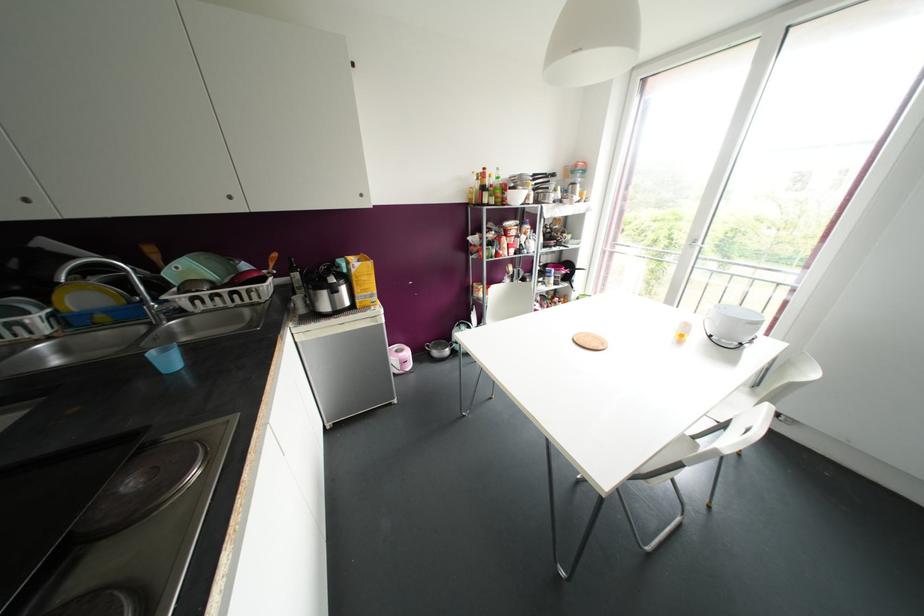
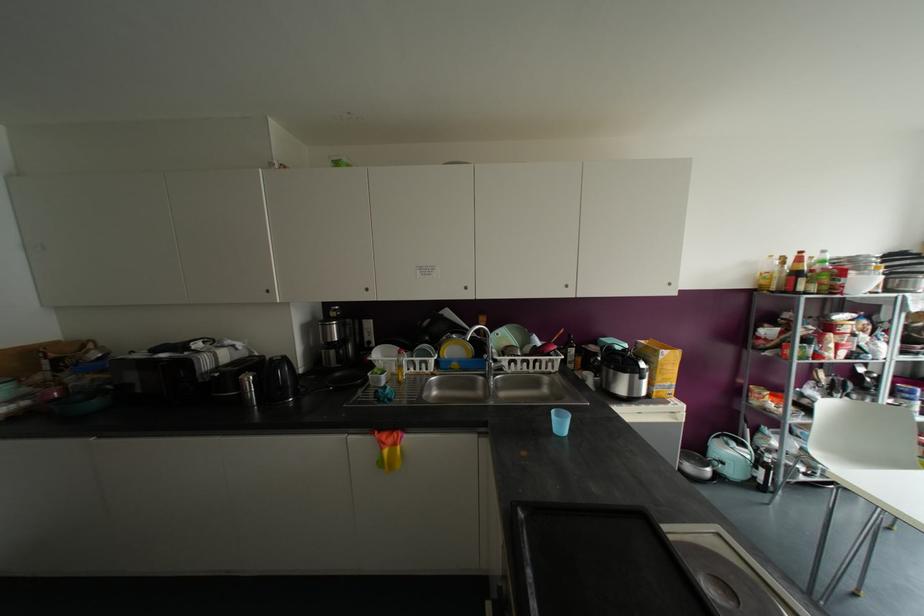
Question: The camera is either moving clockwise (left) or counter-clockwise (right) around the object. The first image is from the beginning of the video and the second image is from the end. Is the camera moving left or right when shooting the video?

Choices:
 (A) Left
 (B) Right

Answer: (B)